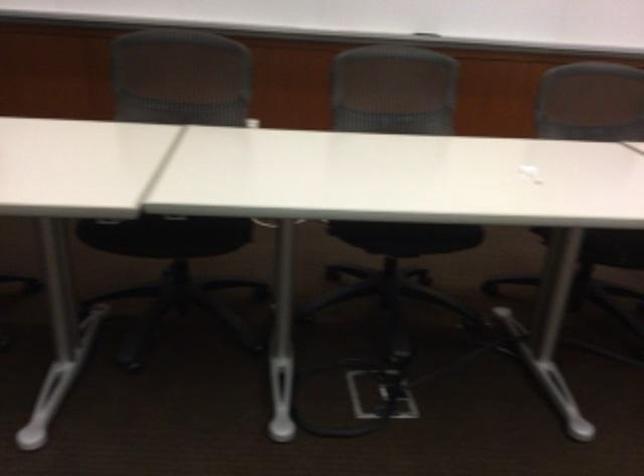
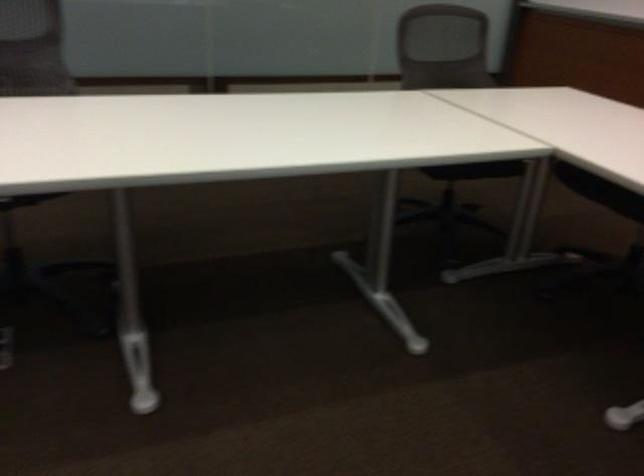
Question: The camera is either moving clockwise (left) or counter-clockwise (right) around the object. The first image is from the beginning of the video and the second image is from the end. Is the camera moving left or right when shooting the video?

Choices:
 (A) Left
 (B) Right

Answer: (B)